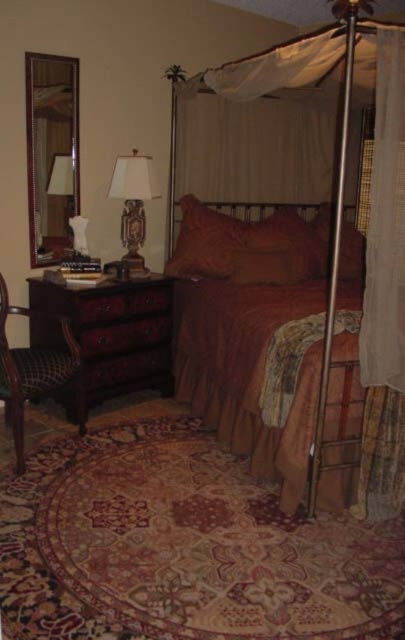
Question: Does brown wood dresser at left appear on the right side of matte brown wood lamp at left?

Choices:
 (A) no
 (B) yes

Answer: (A)

Question: Estimate the real-world distances between objects in this image. Which object is farther from the matte brown fabric canopy bed at center?

Choices:
 (A) matte brown wood lamp at left
 (B) sheer white curtain at right

Answer: (A)

Question: Estimate the real-world distances between objects in this image. Which object is closer to the brown wood dresser at left?

Choices:
 (A) matte brown fabric canopy bed at center
 (B) plaid fabric armchair at left

Answer: (B)

Question: Can you confirm if matte brown fabric canopy bed at center is positioned to the right of brown wood dresser at left?

Choices:
 (A) no
 (B) yes

Answer: (B)

Question: Which is farther from the matte brown wood lamp at left?

Choices:
 (A) plaid fabric armchair at left
 (B) velvet-like brown pillow at center
 (C) matte brown fabric canopy bed at center
 (D) sheer white curtain at right

Answer: (D)

Question: Can you confirm if matte brown fabric canopy bed at center is bigger than velvet-like brown pillow at center?

Choices:
 (A) yes
 (B) no

Answer: (A)